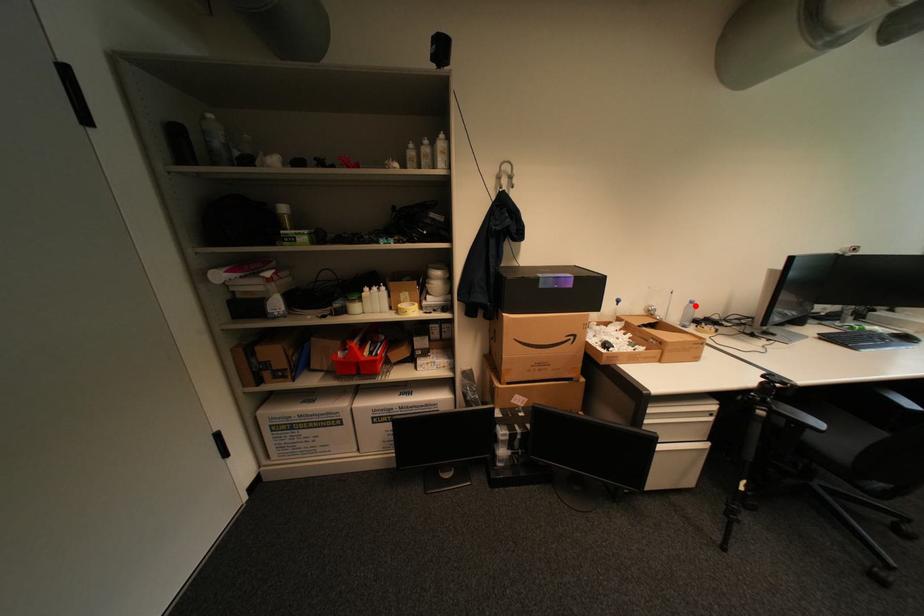
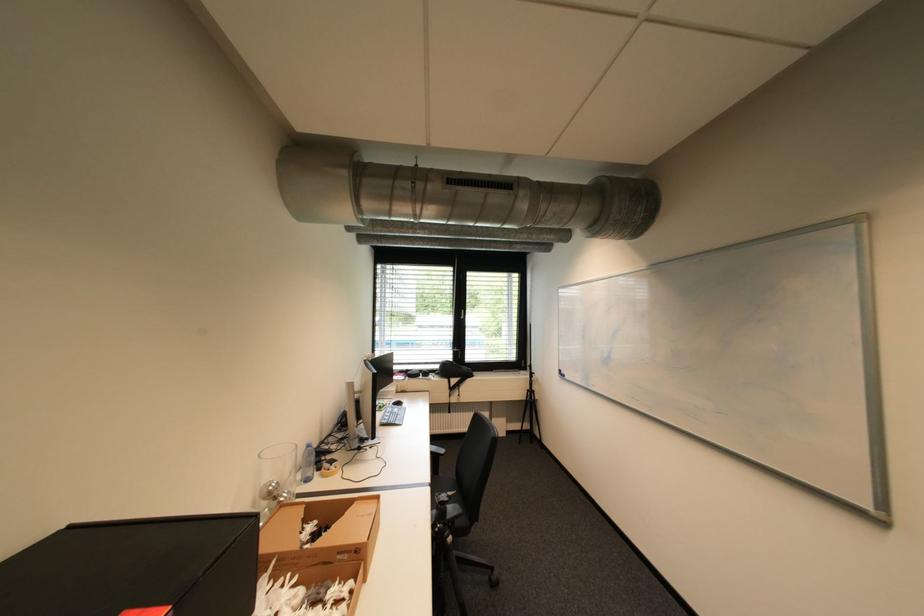
Find the pixel in the second image that matches the highlighted location in the first image.

(313, 451)